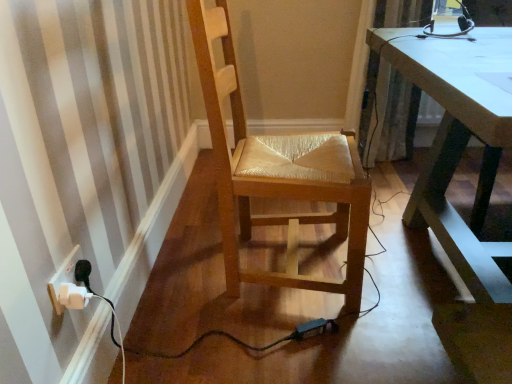
At what (x,y) coordinates should I click in order to perform the action: click on vacant area that is in front of textured beige curtain at upper right. Please return your answer as a coordinate pair (x, y). The image size is (512, 384). Looking at the image, I should click on (396, 182).